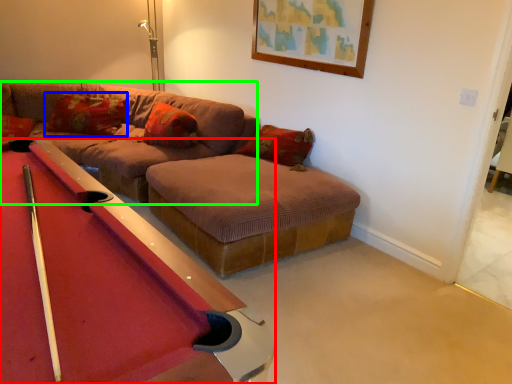
Question: Estimate the real-world distances between objects in this image. Which object is closer to billiard table (highlighted by a red box), pillow (highlighted by a blue box) or couch (highlighted by a green box)?

Choices:
 (A) pillow
 (B) couch

Answer: (B)